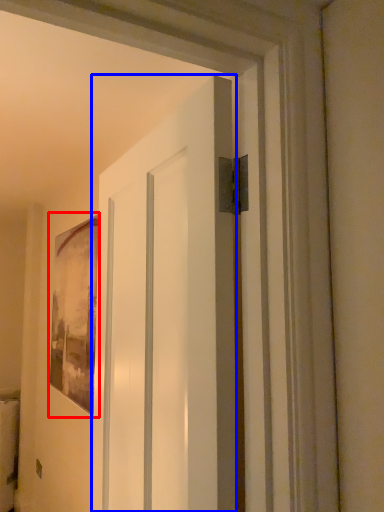
Question: Which point is closer to the camera, picture frame (highlighted by a red box) or door (highlighted by a blue box)?

Choices:
 (A) picture frame
 (B) door

Answer: (B)